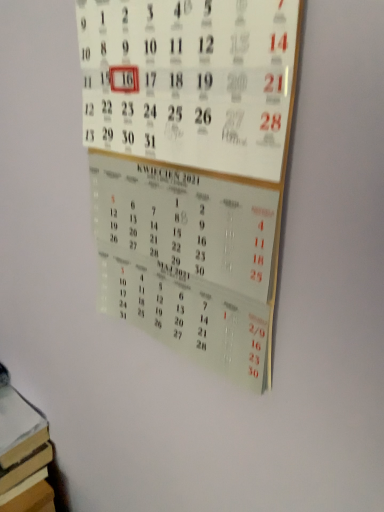
Question: Considering the relative positions of brown cardboard book at lower left and white paper calendar at center in the image provided, is brown cardboard book at lower left to the left or to the right of white paper calendar at center?

Choices:
 (A) left
 (B) right

Answer: (A)

Question: Is brown cardboard book at lower left in front of or behind white paper calendar at center in the image?

Choices:
 (A) front
 (B) behind

Answer: (B)

Question: Choose the correct answer: Is brown cardboard book at lower left inside white paper calendar at center or outside it?

Choices:
 (A) outside
 (B) inside

Answer: (A)

Question: Considering the positions of white paper calendar at center and brown cardboard book at lower left in the image, is white paper calendar at center taller or shorter than brown cardboard book at lower left?

Choices:
 (A) tall
 (B) short

Answer: (A)

Question: From the image's perspective, is white paper calendar at center positioned above or below brown cardboard book at lower left?

Choices:
 (A) below
 (B) above

Answer: (B)

Question: Considering the positions of point pos(238,103) and point pos(18,422), is point pos(238,103) closer or farther from the camera than point pos(18,422)?

Choices:
 (A) farther
 (B) closer

Answer: (B)

Question: Choose the correct answer: Is white paper calendar at center inside brown cardboard book at lower left or outside it?

Choices:
 (A) outside
 (B) inside

Answer: (A)